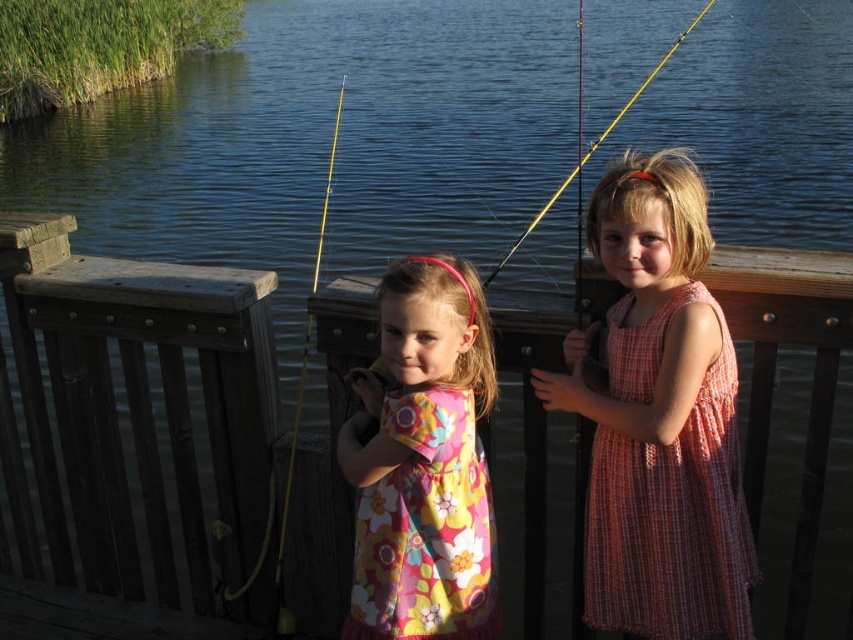
Question: Is plaid cotton dress at center to the left of yellow plastic fishing rod at center from the viewer's perspective?

Choices:
 (A) yes
 (B) no

Answer: (A)

Question: Which of these objects is positioned closest to the floral fabric dress at center?

Choices:
 (A) plaid cotton dress at center
 (B) yellow plastic fishing rod at center
 (C) yellow plastic fishing pole at center

Answer: (A)

Question: Which point is closer to the camera taking this photo?

Choices:
 (A) coord(711,452)
 (B) coord(403,355)
 (C) coord(548,198)
 (D) coord(283,496)

Answer: (B)

Question: Can you confirm if plaid cotton dress at center is positioned above floral fabric dress at center?

Choices:
 (A) yes
 (B) no

Answer: (A)

Question: Is plaid cotton dress at center positioned before yellow plastic fishing rod at center?

Choices:
 (A) no
 (B) yes

Answer: (B)

Question: Which point is closer to the camera taking this photo?

Choices:
 (A) (439, 419)
 (B) (532, 225)
 (C) (323, 214)
 (D) (611, 604)

Answer: (A)